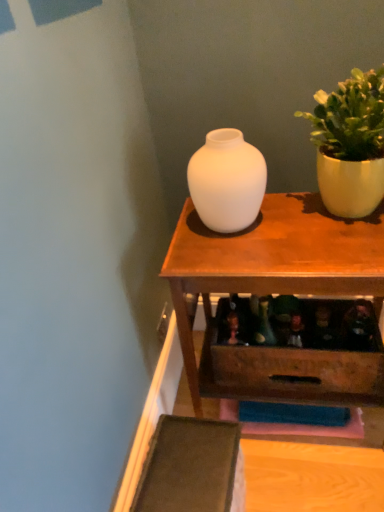
Where is `free area in between matte yellow pot at upper right and white matte vase at center`? The width and height of the screenshot is (384, 512). free area in between matte yellow pot at upper right and white matte vase at center is located at coordinates (287, 220).